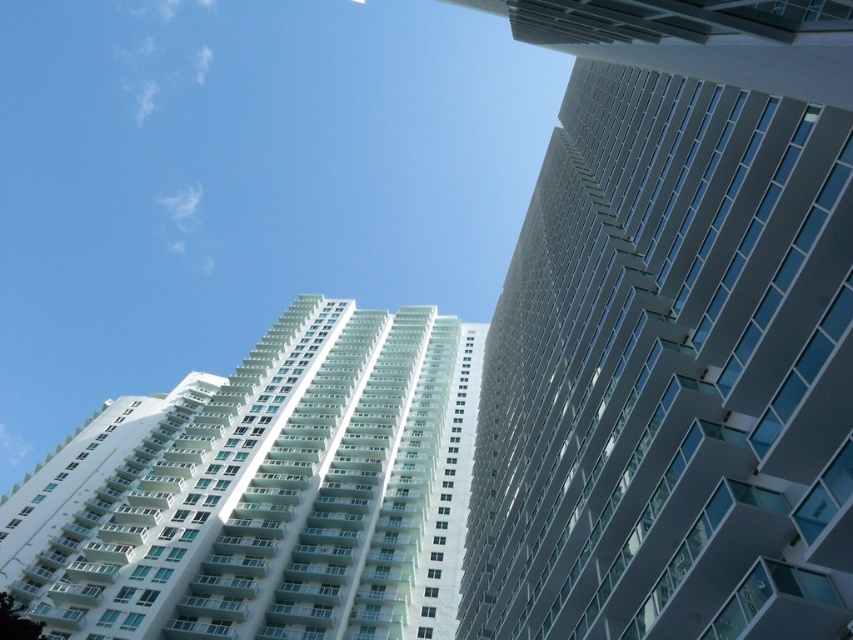
You are a window cleaner with a ladder that can reach up to 100 meters. You need to clean the windows of both the smooth glass building at right and the white glossy building at center. Which building will require you to climb higher to reach its top floor?

The smooth glass building at right is much taller than the white glossy building at center, so you will need to climb higher to reach its top floor.

You are an architect evaluating the space between two buildings in the image. The smooth glass building at right and the white glossy building at center are both part of a new urban development. Based on their widths, which building would require a narrower pathway for construction vehicles to pass between them?

The smooth glass building at right has a smaller width than the white glossy building at center, so the pathway between them would need to be narrower to accommodate the narrower building.